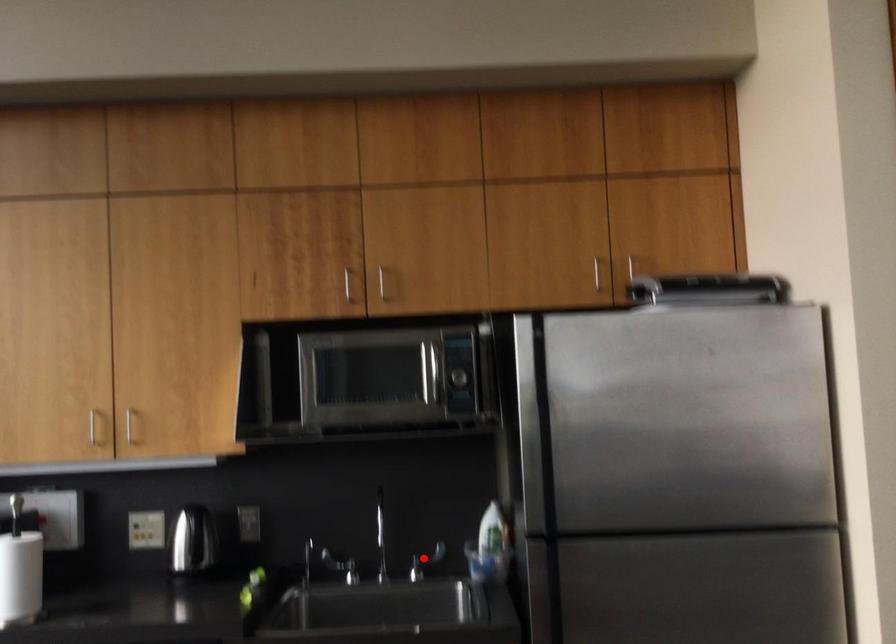
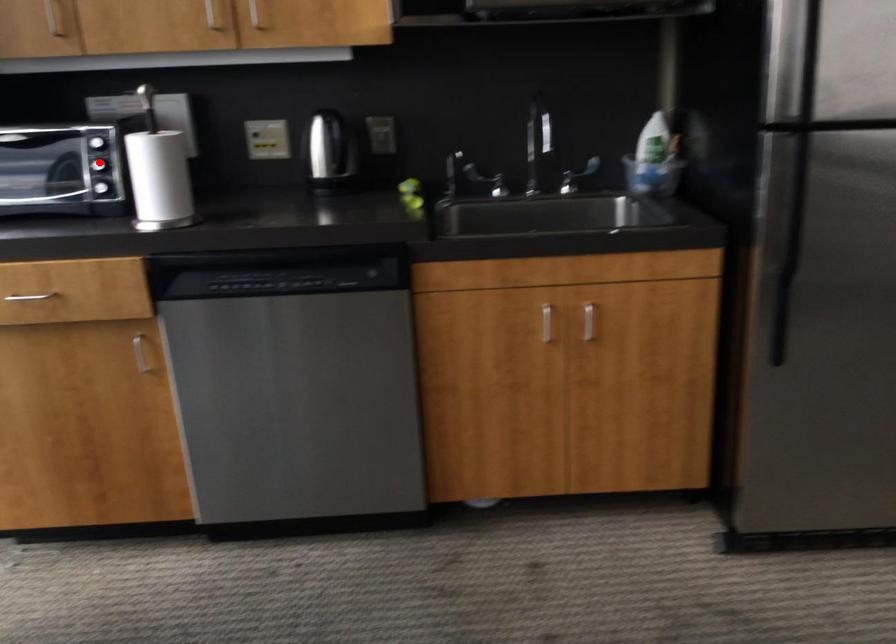
I am providing you with two images of the same scene from different viewpoints. A red point is marked on the first image and another point is marked on the second image. Is the red point in image1 aligned with the point shown in image2?

No